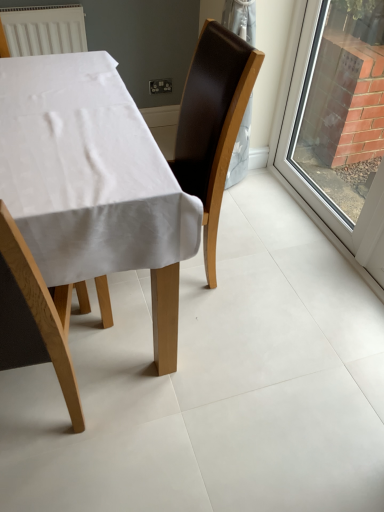
Find the location of `spots to the right of white fabric-covered table at center`. spots to the right of white fabric-covered table at center is located at coordinates (278, 320).